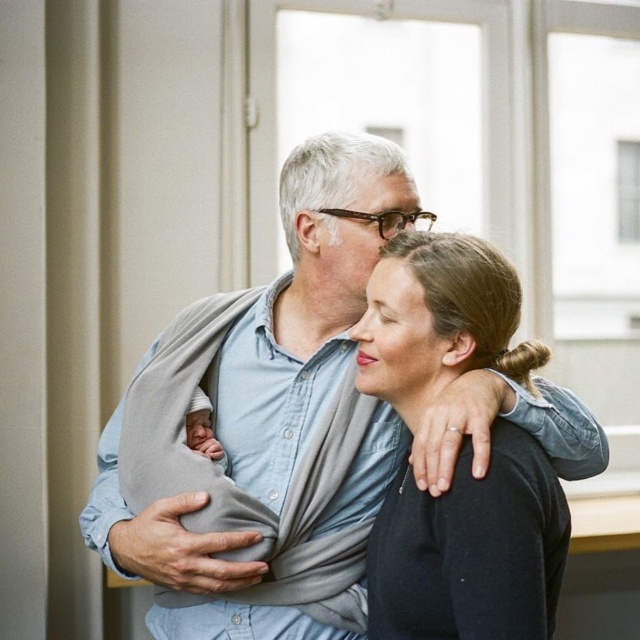
You are a photographer standing at a certain distance from the gray fabric baby carrier at center. You want to take a closeup shot of the baby in the carrier without moving the camera. Is the current distance sufficient for a closeup?

The distance between the gray fabric baby carrier at center and the camera is 1.44 meters. Whether this is sufficient for a closeup depends on the camera lens. A standard lens might require closer proximity, but a telephoto lens could achieve a closeup from this distance.

You are a photographer trying to capture the baby in the center of the frame. The camera has a focus point at coordinates point (307, 305). Is this focus point correctly positioned to capture the baby?

The point (307, 305) corresponds to the gray fabric baby carrier at center, so yes, the focus point is correctly positioned to capture the baby.